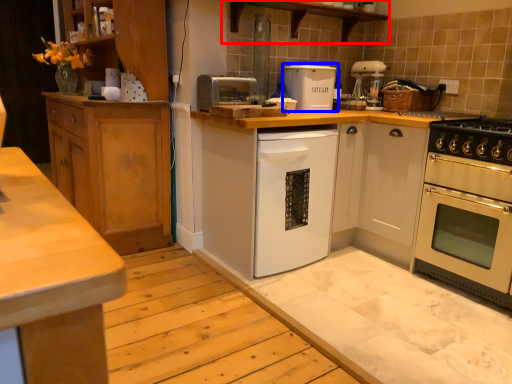
Question: Which point is further to the camera, shelf (highlighted by a red box) or kitchen appliance (highlighted by a blue box)?

Choices:
 (A) shelf
 (B) kitchen appliance

Answer: (B)